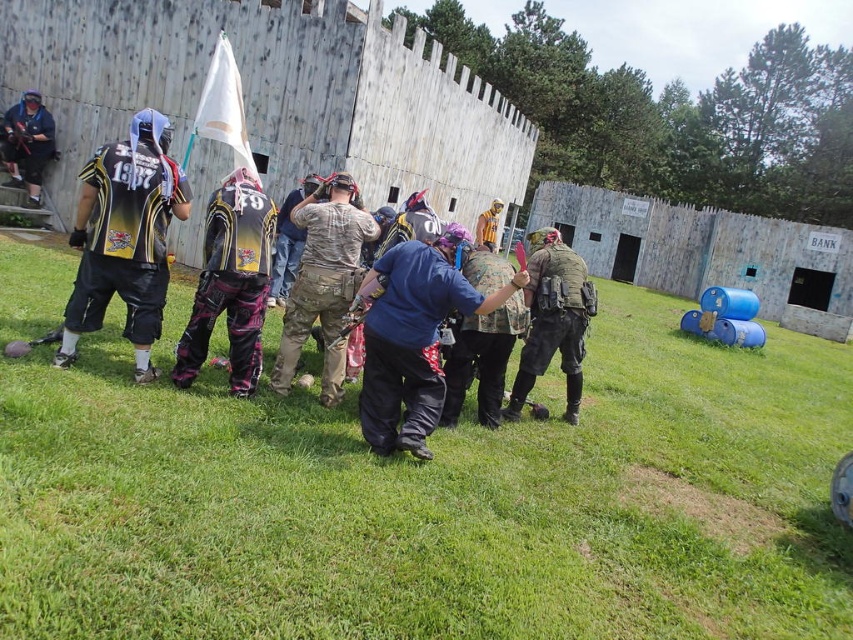
You are a player in the paintball game and need to move from your current position to the wooden fortification. You notice two markers on the field labeled as point (776, 493) and point (485, 371). Which point should you head towards if you want to reach the wooden fortification first?

You should head towards point (485, 371) because it is farther from the camera and closer to the wooden fortification.

You are a game coordinator planning to place a new obstacle at the center of the field. The camouflage pants at center are currently at point 0.517, 0.476. Will placing the obstacle at the exact center interfere with their position?

The camouflage pants at center is located at point (405,330), which is not exactly the center of the field. Placing the obstacle at the exact center would not interfere with their position.

You are a referee observing a paintball game. You notice two players wearing camouflage fabric pants at center and camouflage fabric uniform at center. Which player is positioned to the left side?

The camouflage fabric pants at center is positioned to the left of camouflage fabric uniform at center.